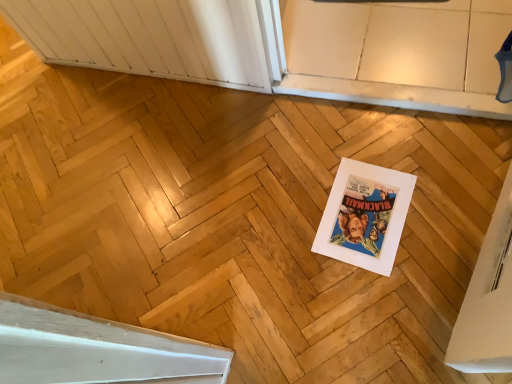
Identify the location of vacant space positioned to the left of white paper comic book at center. The width and height of the screenshot is (512, 384). (290, 244).